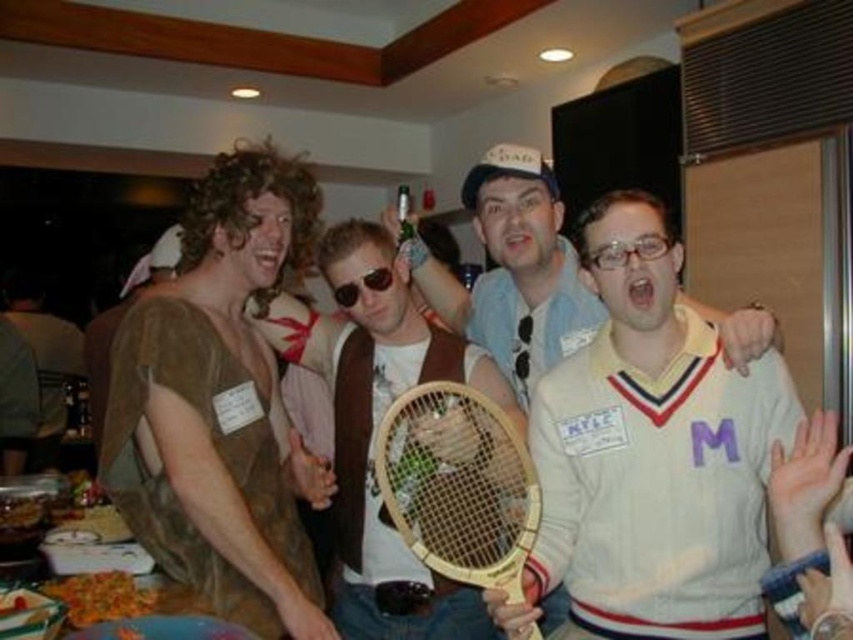
Question: Can you confirm if clear plastic glasses at center is bigger than black plastic sunglasses at center?

Choices:
 (A) no
 (B) yes

Answer: (A)

Question: Can you confirm if clear plastic glasses at center is thinner than black plastic sunglasses at center?

Choices:
 (A) yes
 (B) no

Answer: (B)

Question: Does wooden tennis racket at center appear on the left side of wooden racket at center?

Choices:
 (A) yes
 (B) no

Answer: (A)

Question: Which of the following is the farthest from the observer?

Choices:
 (A) (573, 392)
 (B) (389, 276)
 (C) (352, 218)
 (D) (583, 252)

Answer: (C)

Question: Which object appears closest to the camera in this image?

Choices:
 (A) black plastic sunglasses at center
 (B) wooden racket at center
 (C) clear plastic glasses at center
 (D) white jersey at center

Answer: (D)

Question: Among these points, which one is farthest from the camera?

Choices:
 (A) (399, 480)
 (B) (582, 259)
 (C) (317, 339)
 (D) (726, 381)

Answer: (C)